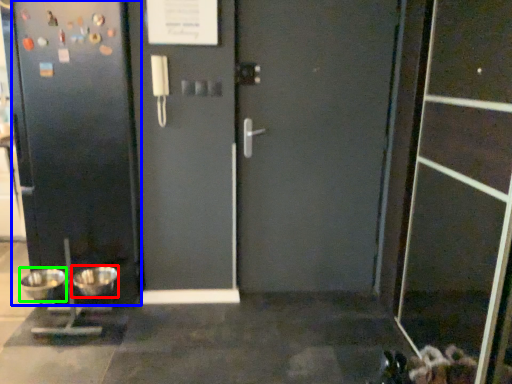
Question: Which is nearer to the mixing bowl (highlighted by a red box)? door (highlighted by a blue box) or mixing bowl (highlighted by a green box).

Choices:
 (A) door
 (B) mixing bowl

Answer: (B)